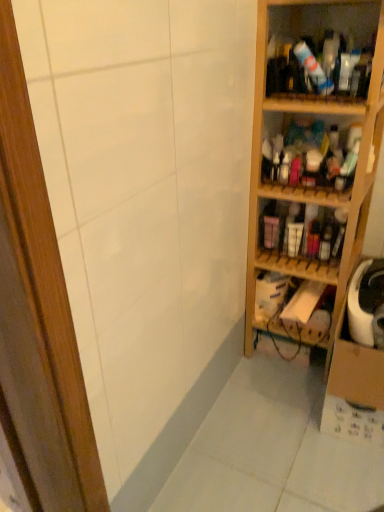
Question: Is wooden shelf at right, positioned as the third shelf in bottom-to-top order, facing towards translucent plastic bottles at upper right, which is counted as the fifth shelf, starting from the bottom?

Choices:
 (A) yes
 (B) no

Answer: (A)

Question: Are wooden shelf at right, the 3th shelf in the top-to-bottom sequence, and translucent plastic bottles at upper right, which is counted as the fifth shelf, starting from the bottom, making contact?

Choices:
 (A) no
 (B) yes

Answer: (A)

Question: Is wooden shelf at right, positioned as the third shelf in bottom-to-top order, in front of translucent plastic bottles at upper right, which is counted as the fifth shelf, starting from the bottom?

Choices:
 (A) yes
 (B) no

Answer: (A)

Question: Would you say wooden shelf at right, positioned as the third shelf in bottom-to-top order, is outside translucent plastic bottles at upper right, arranged as the 1th shelf when viewed from the top?

Choices:
 (A) no
 (B) yes

Answer: (B)

Question: Considering the relative sizes of wooden shelf at right, positioned as the third shelf in bottom-to-top order, and translucent plastic bottles at upper right, arranged as the 1th shelf when viewed from the top, in the image provided, is wooden shelf at right, positioned as the third shelf in bottom-to-top order, thinner than translucent plastic bottles at upper right, arranged as the 1th shelf when viewed from the top,?

Choices:
 (A) no
 (B) yes

Answer: (A)

Question: Does point (342, 38) appear closer or farther from the camera than point (291, 256)?

Choices:
 (A) farther
 (B) closer

Answer: (B)

Question: From a real-world perspective, is translucent plastic bottles at upper right, arranged as the 1th shelf when viewed from the top, above or below matte plastic bottles at center right, the 2th shelf in the bottom-to-top sequence?

Choices:
 (A) below
 (B) above

Answer: (B)

Question: Based on their sizes in the image, would you say translucent plastic bottles at upper right, arranged as the 1th shelf when viewed from the top, is bigger or smaller than matte plastic bottles at center right, which appears as the fourth shelf when viewed from the top?

Choices:
 (A) big
 (B) small

Answer: (A)

Question: In terms of width, does translucent plastic bottles at upper right, which is counted as the fifth shelf, starting from the bottom, look wider or thinner when compared to matte plastic bottles at center right, which appears as the fourth shelf when viewed from the top?

Choices:
 (A) wide
 (B) thin

Answer: (A)

Question: Visually, is wooden shelf at right, which is counted as the 1th shelf, starting from the bottom, positioned to the left or to the right of translucent plastic bottles at upper right, arranged as the 1th shelf when viewed from the top?

Choices:
 (A) left
 (B) right

Answer: (B)

Question: In terms of size, does wooden shelf at right, marked as the fifth shelf in a top-to-bottom arrangement, appear bigger or smaller than translucent plastic bottles at upper right, which is counted as the fifth shelf, starting from the bottom?

Choices:
 (A) big
 (B) small

Answer: (B)

Question: In the image, is wooden shelf at right, marked as the fifth shelf in a top-to-bottom arrangement, positioned in front of or behind translucent plastic bottles at upper right, which is counted as the fifth shelf, starting from the bottom?

Choices:
 (A) behind
 (B) front

Answer: (A)

Question: Is wooden shelf at right, marked as the fifth shelf in a top-to-bottom arrangement, situated inside translucent plastic bottles at upper right, which is counted as the fifth shelf, starting from the bottom, or outside?

Choices:
 (A) inside
 (B) outside

Answer: (B)

Question: In terms of height, does wooden shelves at right, the 4th shelf in the bottom-to-top sequence, look taller or shorter compared to matte plastic bottles at center right, the 2th shelf in the bottom-to-top sequence?

Choices:
 (A) tall
 (B) short

Answer: (A)

Question: Is wooden shelves at right, which appears as the second shelf when viewed from the top, wider or thinner than matte plastic bottles at center right, the 2th shelf in the bottom-to-top sequence?

Choices:
 (A) thin
 (B) wide

Answer: (B)